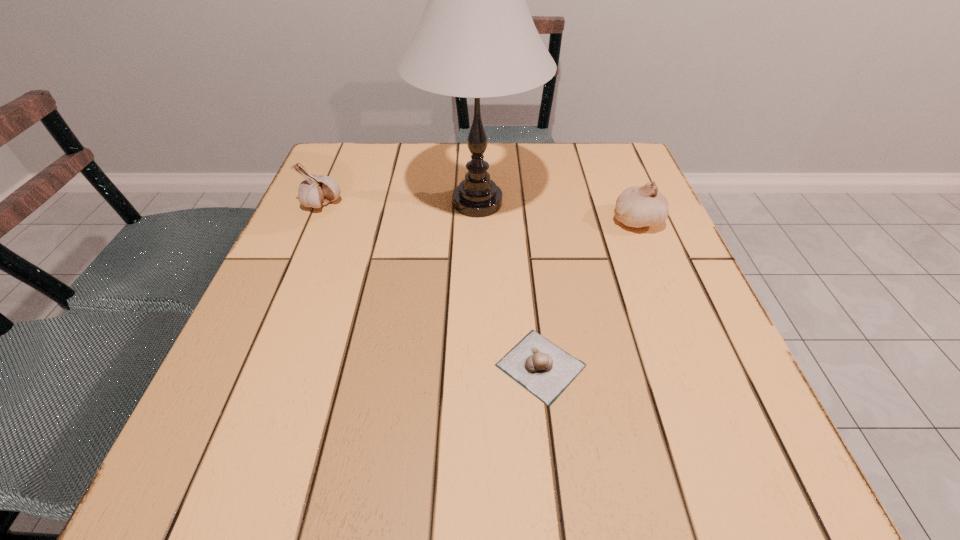
This screenshot has width=960, height=540. Find the location of `object that ranks as the second closest to the rightmost garlic`. object that ranks as the second closest to the rightmost garlic is located at coordinates (544, 369).

Where is `object identified as the second closest to the nearest object`? object identified as the second closest to the nearest object is located at coordinates (638, 206).

Identify the location of garlic that is the second closest one to the nearest object. The image size is (960, 540). (317, 190).

This screenshot has width=960, height=540. I want to click on garlic that is the nearest to the rightmost object, so click(544, 369).

Where is `free spot that satisfies the following two spatial constraints: 1. on the front side of the rightmost garlic; 2. on the left side of the tallest object`? The width and height of the screenshot is (960, 540). free spot that satisfies the following two spatial constraints: 1. on the front side of the rightmost garlic; 2. on the left side of the tallest object is located at coordinates (477, 220).

Where is `free spot that satisfies the following two spatial constraints: 1. on the front side of the tallest object; 2. on the right side of the second garlic from left to right`? free spot that satisfies the following two spatial constraints: 1. on the front side of the tallest object; 2. on the right side of the second garlic from left to right is located at coordinates [477, 366].

Locate an element on the screen. This screenshot has width=960, height=540. vacant space that satisfies the following two spatial constraints: 1. on the back side of the tallest object; 2. on the left side of the leftmost object is located at coordinates (323, 203).